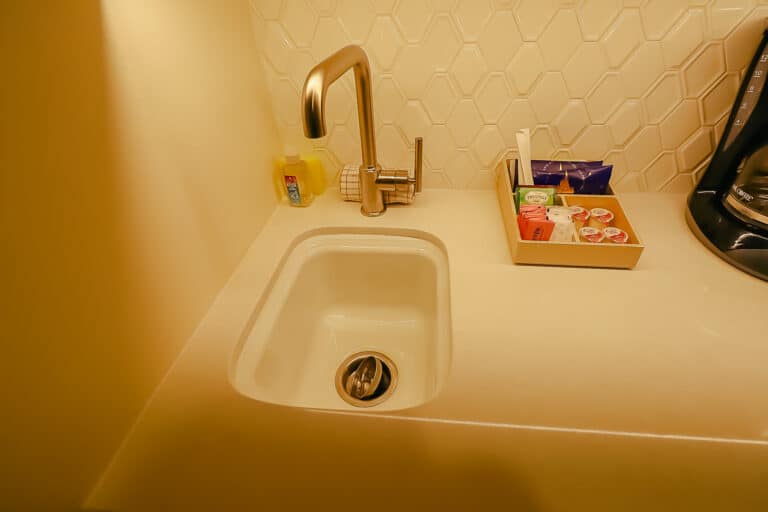
Find the location of `ceramic sink`. ceramic sink is located at coordinates (363, 263).